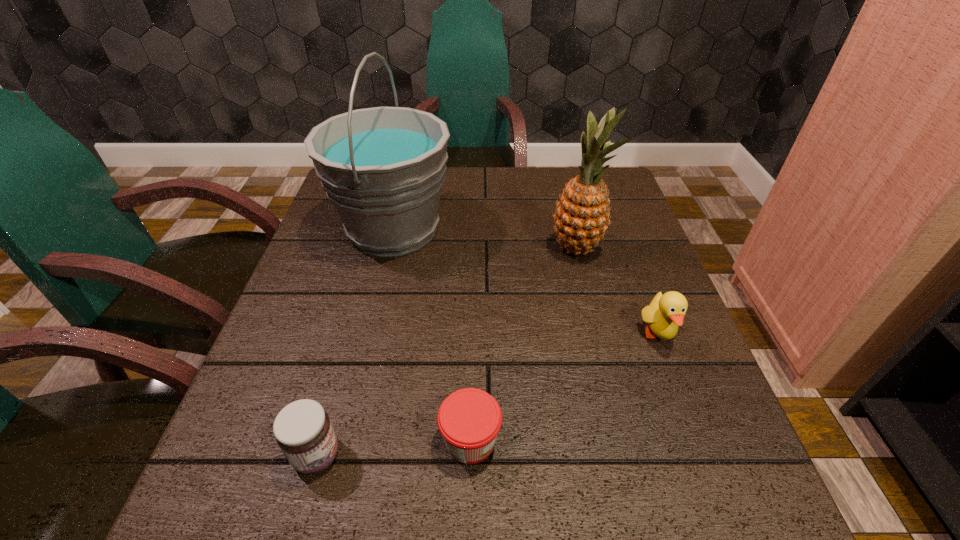
You are a GUI agent. You are given a task and a screenshot of the screen. Output one action in this format:
    pyautogui.click(x=<x>, y=<y>)
    Task: Click on the vacant space in between the second object from right to left and the taller jam
    The height and width of the screenshot is (540, 960).
    Given the screenshot: What is the action you would take?
    pyautogui.click(x=446, y=352)

Select which object is the third closest to the left jam. Please provide its 2D coordinates. Your answer should be formatted as a tuple, i.e. [(x, y)], where the tuple contains the x and y coordinates of a point satisfying the conditions above.

[(666, 312)]

Locate which object ranks second in proximity to the taller jam. Please provide its 2D coordinates. Your answer should be formatted as a tuple, i.e. [(x, y)], where the tuple contains the x and y coordinates of a point satisfying the conditions above.

[(383, 168)]

The image size is (960, 540). In order to click on free spot that satisfies the following two spatial constraints: 1. on the front-facing side of the rightmost object; 2. on the label side of the shorter jam in this screenshot , I will do `click(698, 440)`.